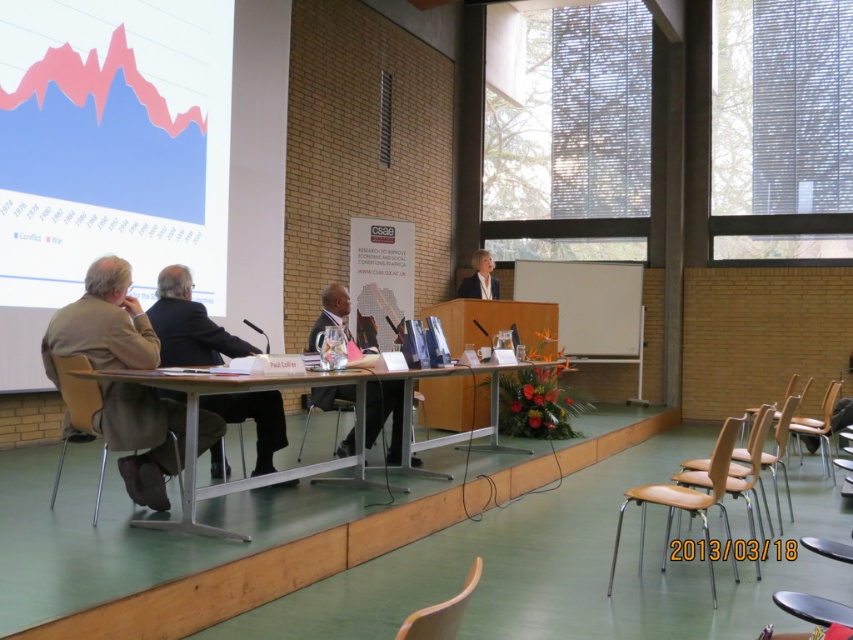
Which of these two, metallic silver chair at lower right or light beige suit at center, stands taller?

light beige suit at center

Which is behind, point (843, 612) or point (494, 284)?

The point (494, 284) is more distant.

I want to click on metallic silver chair at lower right, so click(x=813, y=608).

Does matte white projection screen at upper left have a lesser width compared to wooden table at center?

Correct, matte white projection screen at upper left's width is less than wooden table at center's.

Which is below, matte white projection screen at upper left or wooden table at center?

wooden table at center is lower down.

Who is more forward, (192,141) or (192,397)?

Point (192,397)

Where is `matte white projection screen at upper left`? The width and height of the screenshot is (853, 640). matte white projection screen at upper left is located at coordinates (112, 141).

How far apart are brown leather chair at right and light beige suit at center?

A distance of 3.22 meters exists between brown leather chair at right and light beige suit at center.

Does point (631, 488) lie behind point (474, 257)?

No.

Does point (618, 536) come behind point (465, 278)?

No, it is in front of (465, 278).

You are a GUI agent. You are given a task and a screenshot of the screen. Output one action in this format:
    pyautogui.click(x=<x>, y=<y>)
    Task: Click on the brown leather chair at right
    
    Given the screenshot: What is the action you would take?
    pyautogui.click(x=683, y=499)